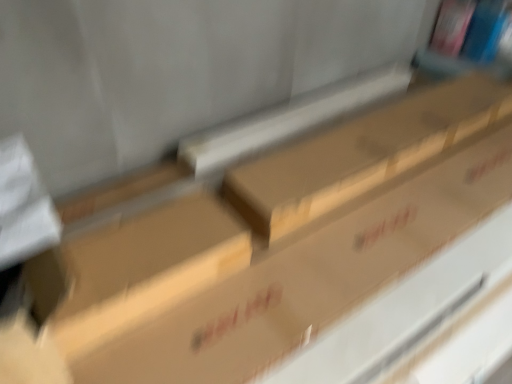
This screenshot has width=512, height=384. Find the location of `vacant area that is situated to the right of brown cardboard box at center`. vacant area that is situated to the right of brown cardboard box at center is located at coordinates click(x=279, y=291).